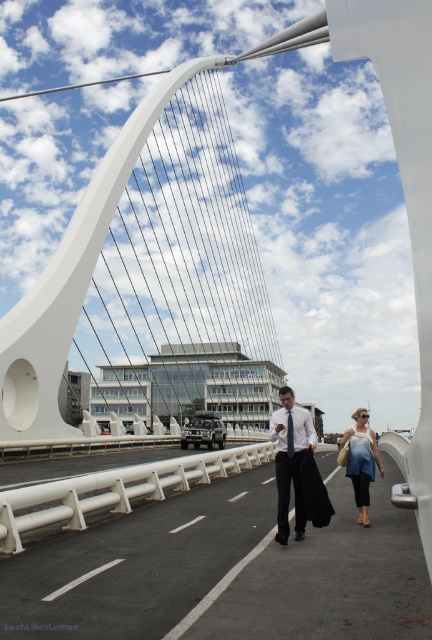
You are a photographer standing on the pedestrian bridge and want to take a photo of the two people walking towards you. The white shirt with tie at center and the blue denim jacket at lower right are in your viewfinder. Which person should you focus on first to capture them as they approach?

The white shirt with tie at center is in front of the blue denim jacket at lower right, so you should focus on the white shirt with tie at center first as they approach.

You are a photographer standing on the pedestrian bridge. You want to take a photo of the white shirt with tie at center and the blue denim jacket at lower right. What is the minimum distance you need to move forward to ensure both subjects are in frame?

The minimum distance you need to move forward is 1.52 meters to ensure both the white shirt with tie at center and the blue denim jacket at lower right are in frame.